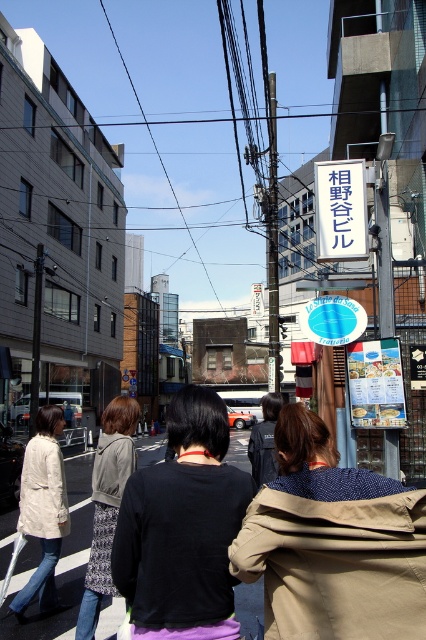
What do you see at coordinates (333, 544) in the screenshot?
I see `tan fabric jacket at center` at bounding box center [333, 544].

Can you confirm if tan fabric jacket at center is positioned to the left of light beige jacket at lower left?

No, tan fabric jacket at center is not to the left of light beige jacket at lower left.

Find the location of a particular element. Image resolution: width=426 pixels, height=640 pixels. tan fabric jacket at center is located at coordinates (333, 544).

This screenshot has height=640, width=426. Find the location of `tan fabric jacket at center`. tan fabric jacket at center is located at coordinates (333, 544).

Can you confirm if black fabric shirt at center is taller than dark blue jacket at center?

No, black fabric shirt at center is not taller than dark blue jacket at center.

Is black fabric shirt at center above dark blue jacket at center?

Yes, black fabric shirt at center is above dark blue jacket at center.

Describe the element at coordinates (183, 529) in the screenshot. I see `black fabric shirt at center` at that location.

Find the location of `black fabric shirt at center`. black fabric shirt at center is located at coordinates (183, 529).

Is white plastic sign at upper center above dark blue jacket at center?

Indeed, white plastic sign at upper center is positioned over dark blue jacket at center.

Is point (351, 218) farther from viewer compared to point (268, 465)?

Yes, point (351, 218) is behind point (268, 465).

The width and height of the screenshot is (426, 640). Find the location of `white plastic sign at upper center`. white plastic sign at upper center is located at coordinates (340, 211).